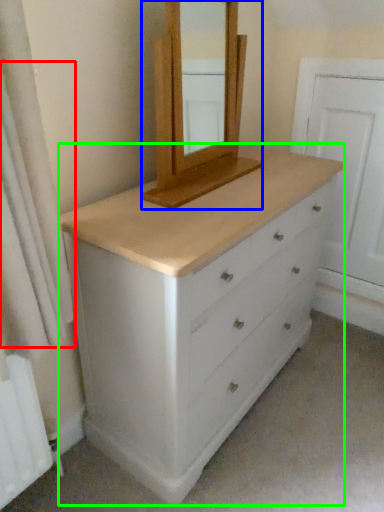
Question: Which object is the closest to the shower curtain (highlighted by a red box)? Choose among these: medicine cabinet (highlighted by a blue box) or chest of drawers (highlighted by a green box).

Choices:
 (A) medicine cabinet
 (B) chest of drawers

Answer: (B)